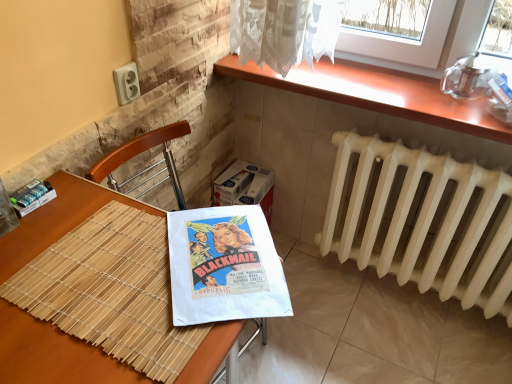
What is the approximate height of white cardboard box at center?

white cardboard box at center is 36.37 centimeters tall.

Describe the element at coordinates (53, 354) in the screenshot. I see `wooden table at lower left` at that location.

Locate an element on the screen. white matte radiator at right is located at coordinates (422, 221).

Can you confirm if wooden table at lower left is wider than white matte radiator at right?

Correct, the width of wooden table at lower left exceeds that of white matte radiator at right.

From the image's perspective, would you say wooden table at lower left is positioned over white matte radiator at right?

Incorrect, from the image's perspective, wooden table at lower left is lower than white matte radiator at right.

Who is smaller, wooden table at lower left or white matte radiator at right?

Smaller between the two is white matte radiator at right.

From a real-world perspective, which is physically above, wooden table at lower left or white cardboard box at center?

wooden table at lower left.

How different are the orientations of wooden table at lower left and white cardboard box at center in degrees?

There is a 0.143-degree angle between the facing directions of wooden table at lower left and white cardboard box at center.

Considering the sizes of objects wooden table at lower left and white cardboard box at center in the image provided, who is bigger, wooden table at lower left or white cardboard box at center?

wooden table at lower left is bigger.

Considering the relative positions of wooden table at lower left and white cardboard box at center in the image provided, is wooden table at lower left to the left or to the right of white cardboard box at center?

From the image, it's evident that wooden table at lower left is to the left of white cardboard box at center.

Which of these two, white cardboard box at center or white matte radiator at right, is smaller?

white cardboard box at center.

Looking at this image, can you confirm if white cardboard box at center is thinner than white matte radiator at right?

No.

Considering the positions of objects white cardboard box at center and white matte radiator at right in the image provided, who is more to the right, white cardboard box at center or white matte radiator at right?

Positioned to the right is white matte radiator at right.

At what (x,y) coordinates should I click in order to perform the action: click on radiator in front of the white cardboard box at center. Please return your answer as a coordinate pair (x, y). The width and height of the screenshot is (512, 384). Looking at the image, I should click on (422, 221).

Can you confirm if white cardboard box at center is taller than wooden at upper right?

Correct, white cardboard box at center is much taller as wooden at upper right.

Which of these two, white cardboard box at center or wooden at upper right, is wider?

wooden at upper right is wider.

In the scene shown: Is white cardboard box at center positioned with its back to wooden at upper right?

No, wooden at upper right is not at the back of white cardboard box at center.

Measure the distance from white cardboard box at center to wooden at upper right.

23.14 inches.

Considering the positions of point (230, 68) and point (470, 271), is point (230, 68) closer or farther from the camera than point (470, 271)?

Clearly, point (230, 68) is more distant from the camera than point (470, 271).

Is the surface of wooden at upper right in direct contact with white matte radiator at right?

No.

Would you say wooden at upper right is inside or outside white matte radiator at right?

The correct answer is: outside.

Could you tell me if white matte radiator at right is turned towards wooden table at lower left?

Yes, white matte radiator at right is facing wooden table at lower left.

You are a GUI agent. You are given a task and a screenshot of the screen. Output one action in this format:
    pyautogui.click(x=<x>, y=<y>)
    Task: Click on the table in front of the white matte radiator at right
    The image size is (512, 384).
    Given the screenshot: What is the action you would take?
    pyautogui.click(x=53, y=354)

From a real-world perspective, between white matte radiator at right and wooden table at lower left, who is vertically higher?

wooden table at lower left.

Is white matte radiator at right taller or shorter than wooden table at lower left?

Considering their sizes, white matte radiator at right has less height than wooden table at lower left.

Are white cardboard box at center and wooden table at lower left beside each other?

No, white cardboard box at center is not making contact with wooden table at lower left.

From the image's perspective, does white cardboard box at center appear higher than wooden table at lower left?

Yes, from the image's perspective, white cardboard box at center is over wooden table at lower left.

Would you say wooden table at lower left is part of white cardboard box at center's contents?

No, wooden table at lower left is not inside white cardboard box at center.

This screenshot has width=512, height=384. Identify the location of radiator above the wooden table at lower left (from the image's perspective). pos(422,221).

At what (x,y) coordinates should I click in order to perform the action: click on cardboard box behind the wooden table at lower left. Please return your answer as a coordinate pair (x, y). Image resolution: width=512 pixels, height=384 pixels. Looking at the image, I should click on (245, 187).

Based on their spatial positions, is white matte radiator at right or wooden table at lower left further from wooden at upper right?

wooden table at lower left lies further to wooden at upper right than the other object.

Which object lies nearer to the anchor point wooden table at lower left, white cardboard box at center or white matte radiator at right?

white cardboard box at center.

Estimate the real-world distances between objects in this image. Which object is further from wooden table at lower left, wooden at upper right or white matte radiator at right?

white matte radiator at right is positioned further to the anchor wooden table at lower left.

When comparing their distances from wooden at upper right, does white cardboard box at center or wooden table at lower left seem further?

wooden table at lower left is further to wooden at upper right.

Considering their positions, is white matte radiator at right positioned closer to white cardboard box at center than wooden table at lower left?

Among the two, white matte radiator at right is located nearer to white cardboard box at center.

Looking at the image, which one is located further to wooden table at lower left, white cardboard box at center or wooden at upper right?

The object further to wooden table at lower left is white cardboard box at center.

Based on the photo, which object lies nearer to the anchor point wooden at upper right, white cardboard box at center or white matte radiator at right?

The object closer to wooden at upper right is white matte radiator at right.

From the image, which object appears to be farther from wooden at upper right, white matte radiator at right or white cardboard box at center?

white cardboard box at center lies further to wooden at upper right than the other object.

You are a GUI agent. You are given a task and a screenshot of the screen. Output one action in this format:
    pyautogui.click(x=<x>, y=<y>)
    Task: Click on the counter top located between wooden table at lower left and white matte radiator at right in the left-right direction
    The width and height of the screenshot is (512, 384).
    Given the screenshot: What is the action you would take?
    pyautogui.click(x=377, y=93)

Find the location of a particular element. This screenshot has height=384, width=512. counter top between white cardboard box at center and white matte radiator at right from left to right is located at coordinates (377, 93).

At what (x,y) coordinates should I click in order to perform the action: click on radiator between wooden table at lower left and white cardboard box at center along the z-axis. Please return your answer as a coordinate pair (x, y). Looking at the image, I should click on (422, 221).

At what (x,y) coordinates should I click in order to perform the action: click on counter top between wooden table at lower left and white cardboard box at center in the front-back direction. Please return your answer as a coordinate pair (x, y). The image size is (512, 384). Looking at the image, I should click on (377, 93).